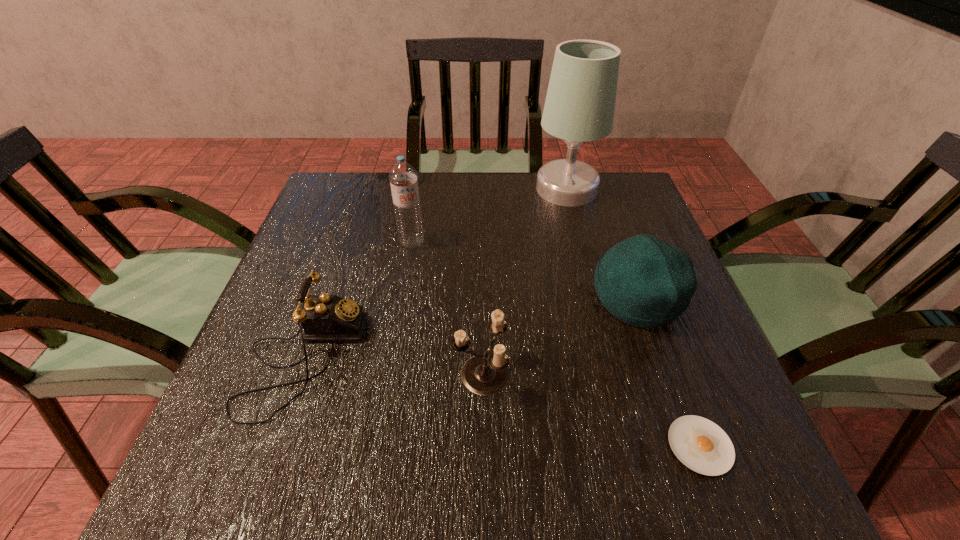
I want to click on free space between the telephone and the egg yolk, so click(x=501, y=402).

What are the coordinates of `empty location between the candle holder and the leftmost object` in the screenshot? It's located at (393, 367).

Identify the location of vacant space that is in between the candle holder and the water bottle. (446, 308).

What are the coordinates of `unoccupied position between the egg yolk and the third object from left to right` in the screenshot? It's located at (590, 410).

Locate an element on the screen. Image resolution: width=960 pixels, height=540 pixels. free point between the lampshade and the leftmost object is located at coordinates (435, 274).

I want to click on vacant area between the second object from left to right and the beanie, so click(525, 270).

I want to click on vacant region between the egg yolk and the candle holder, so click(x=590, y=410).

Where is `unoccupied area between the second object from left to right and the egg yolk`? unoccupied area between the second object from left to right and the egg yolk is located at coordinates (556, 343).

This screenshot has height=540, width=960. In order to click on free spot between the candle holder and the farthest object in this screenshot , I will do `click(524, 281)`.

Identify the location of object that can be found as the closest to the candle holder. (324, 317).